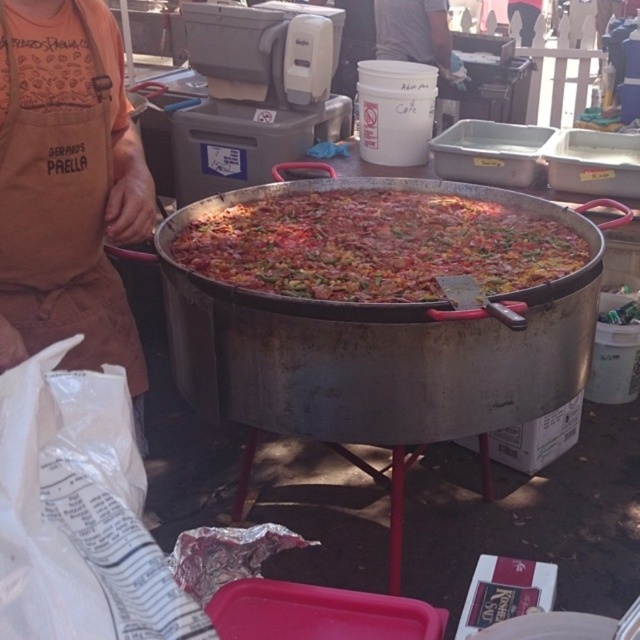
Who is positioned more to the left, brown apron at left or multicolored rice at center?

brown apron at left is more to the left.

Between brown apron at left and multicolored rice at center, which one is positioned lower?

brown apron at left

In order to click on brown apron at left in this screenshot , I will do `click(67, 188)`.